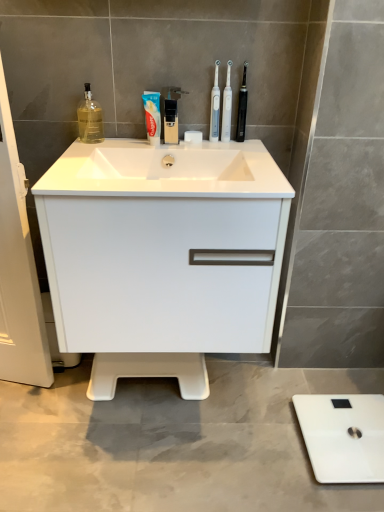
Find the location of a particular element. This screenshot has width=384, height=512. vacant area that lies in front of black plastic toothbrush at upper center, the third toothbrush in the left-to-right sequence is located at coordinates (249, 153).